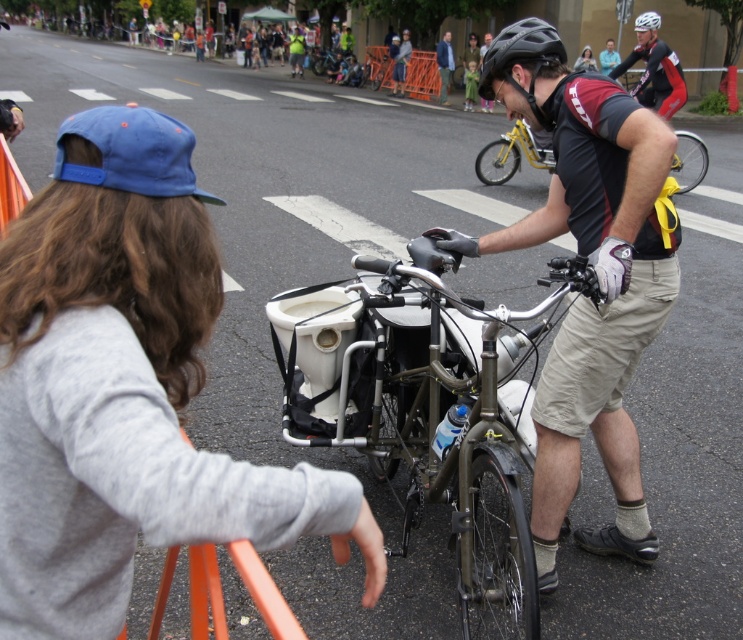
Consider the image. Based on the scene description, is the matte black helmet at center taller than the metallic silver bicycle at center?

Yes, the matte black helmet at center is taller than the metallic silver bicycle at center according to the description.

You are a photographer positioned at the front of the scene. You want to capture a clear shot of the black matte bicycle helmet at upper center without the gray cotton sweatshirt at upper left blocking it. What should you do?

Move your camera position to the right so that the gray cotton sweatshirt at upper left is no longer in front of the black matte bicycle helmet at upper center.